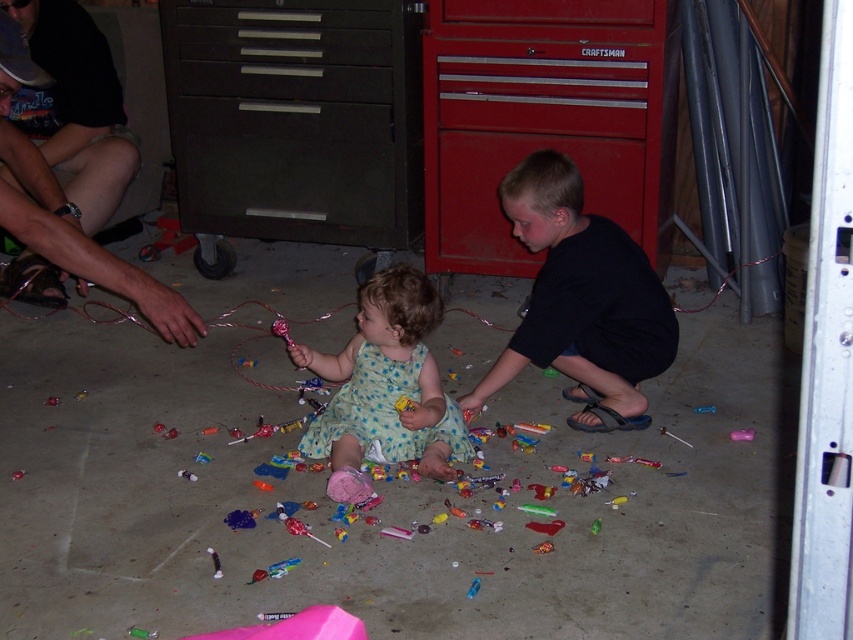
The width and height of the screenshot is (853, 640). What are the coordinates of `black matte shirt at center` in the screenshot? It's located at (581, 300).

Between black matte shirt at center and brown leather sandal at left, which one is positioned lower?

black matte shirt at center is lower down.

Find the location of `black matte shirt at center`. black matte shirt at center is located at coordinates (581, 300).

Who is lower down, black matte shirt at center or floral dress at center?

Positioned lower is floral dress at center.

You are a GUI agent. You are given a task and a screenshot of the screen. Output one action in this format:
    pyautogui.click(x=<x>, y=<y>)
    Task: Click on the black matte shirt at center
    
    Given the screenshot: What is the action you would take?
    pyautogui.click(x=581, y=300)

Does point (79, 182) come behind point (396, 323)?

Yes, point (79, 182) is behind point (396, 323).

Identify the location of brown leather sandal at left. (70, 188).